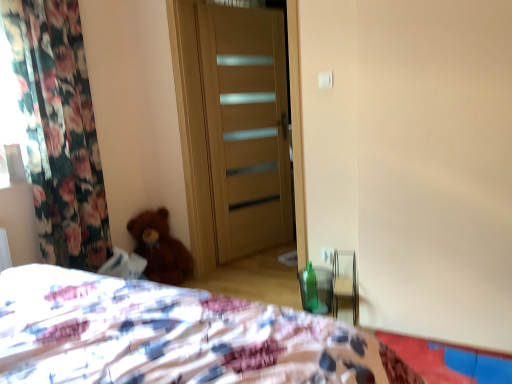
Question: Should I look upward or downward to see light brown wood door at center?

Choices:
 (A) up
 (B) down

Answer: (A)

Question: Considering the relative positions of green glass bottle at lower right and brown plush teddy bear at lower left in the image provided, is green glass bottle at lower right to the right of brown plush teddy bear at lower left from the viewer's perspective?

Choices:
 (A) yes
 (B) no

Answer: (A)

Question: Considering the relative sizes of green glass bottle at lower right and brown plush teddy bear at lower left in the image provided, is green glass bottle at lower right taller than brown plush teddy bear at lower left?

Choices:
 (A) no
 (B) yes

Answer: (A)

Question: Is green glass bottle at lower right oriented towards brown plush teddy bear at lower left?

Choices:
 (A) no
 (B) yes

Answer: (B)

Question: From the image's perspective, would you say green glass bottle at lower right is shown under brown plush teddy bear at lower left?

Choices:
 (A) yes
 (B) no

Answer: (A)

Question: From a real-world perspective, is green glass bottle at lower right located beneath brown plush teddy bear at lower left?

Choices:
 (A) no
 (B) yes

Answer: (B)

Question: From the image's perspective, is green glass bottle at lower right over brown plush teddy bear at lower left?

Choices:
 (A) yes
 (B) no

Answer: (B)

Question: Can you confirm if light brown wood door at center is thinner than green glass bottle at lower right?

Choices:
 (A) yes
 (B) no

Answer: (B)

Question: Is light brown wood door at center completely or partially outside of green glass bottle at lower right?

Choices:
 (A) yes
 (B) no

Answer: (A)

Question: Can you confirm if light brown wood door at center is smaller than green glass bottle at lower right?

Choices:
 (A) yes
 (B) no

Answer: (B)

Question: Considering the relative sizes of light brown wood door at center and green glass bottle at lower right in the image provided, is light brown wood door at center bigger than green glass bottle at lower right?

Choices:
 (A) no
 (B) yes

Answer: (B)

Question: Is light brown wood door at center surrounding green glass bottle at lower right?

Choices:
 (A) no
 (B) yes

Answer: (A)

Question: From a real-world perspective, is light brown wood door at center positioned under green glass bottle at lower right based on gravity?

Choices:
 (A) yes
 (B) no

Answer: (B)

Question: Does brown plush teddy bear at lower left have a greater width compared to green glass bottle at lower right?

Choices:
 (A) no
 (B) yes

Answer: (B)